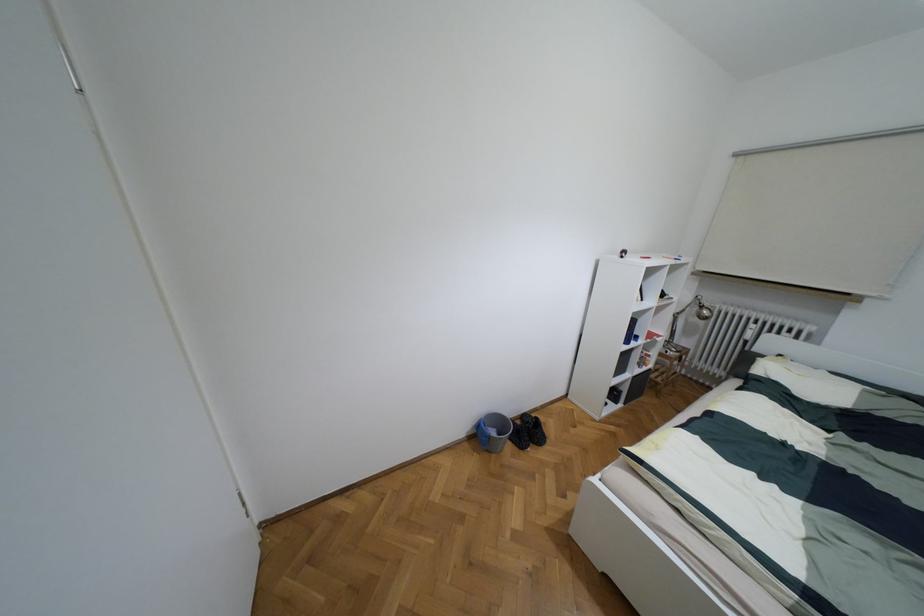
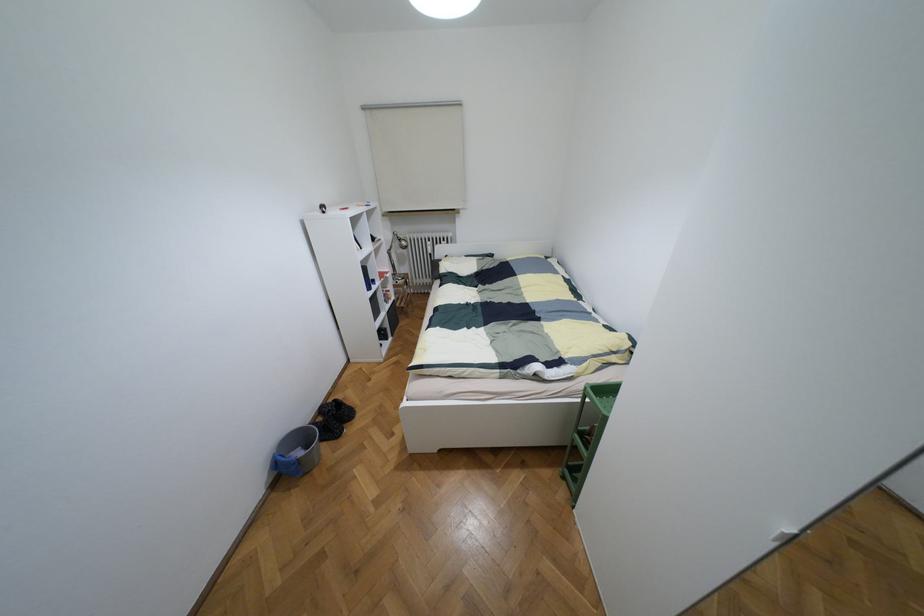
How did the camera likely rotate?

The rotation direction of the camera is right-down.